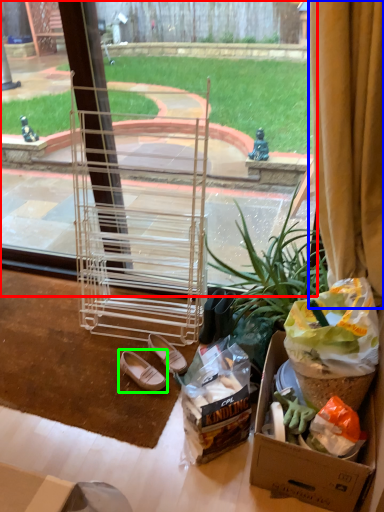
Question: Considering the real-world distances, which object is closest to window screen (highlighted by a red box)? curtain (highlighted by a blue box) or footwear (highlighted by a green box).

Choices:
 (A) curtain
 (B) footwear

Answer: (A)